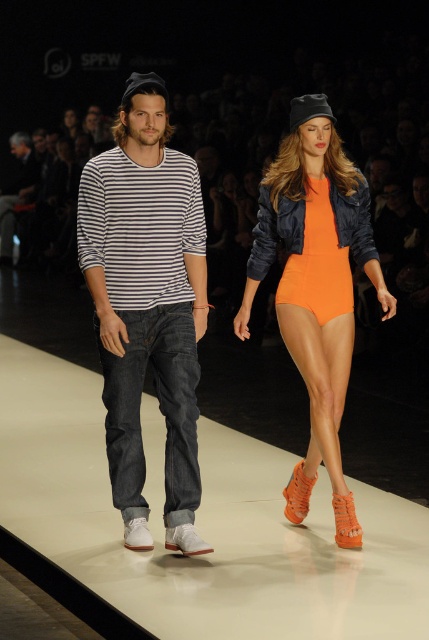
Question: Among these points, which one is farthest from the camera?

Choices:
 (A) (14, 152)
 (B) (307, 298)
 (C) (175, 384)

Answer: (A)

Question: Is orange matte bodysuit at center thinner than denim jeans at center?

Choices:
 (A) no
 (B) yes

Answer: (B)

Question: Can you confirm if striped cotton shirt at center is positioned above denim jeans at center?

Choices:
 (A) yes
 (B) no

Answer: (B)

Question: Which point is farther to the camera?

Choices:
 (A) denim jeans at center
 (B) orange matte bodysuit at center
 (C) striped cotton shirt at center

Answer: (A)

Question: Which object is the closest to the denim jeans at center?

Choices:
 (A) striped cotton shirt at center
 (B) orange matte bodysuit at center

Answer: (A)

Question: Does orange matte bodysuit at center have a larger size compared to denim jeans at center?

Choices:
 (A) yes
 (B) no

Answer: (B)